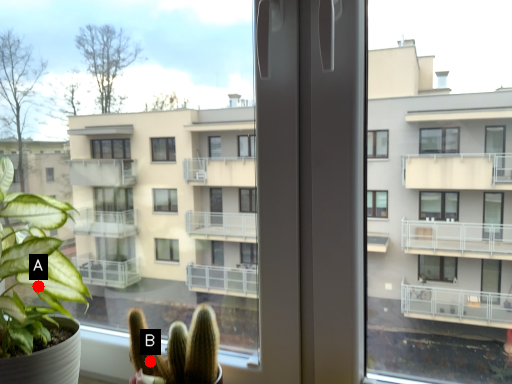
Question: Two points are circled on the image, labeled by A and B beside each circle. Which point is closer to the camera?

Choices:
 (A) A is closer
 (B) B is closer

Answer: (B)